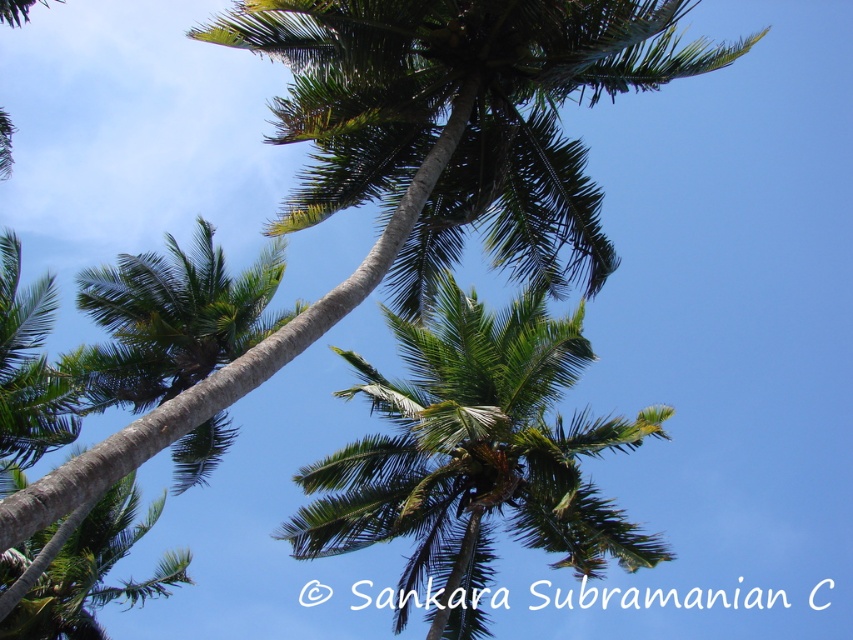
You are standing under the palm trees and looking up. There are two points marked in the scene. The first point is at coordinate point (285, 531) and the second is at point (166, 296). Which point is closer to your eyes?

Point (285, 531) is further to the viewer than point (166, 296), so the second point at (166, 296) is closer to your eyes.

You are standing under the palm trees and looking up. There is a point marked at coordinates [474,456]. What object is located at that point?

The point at [474,456] is where the green leafy palm tree at center is located.